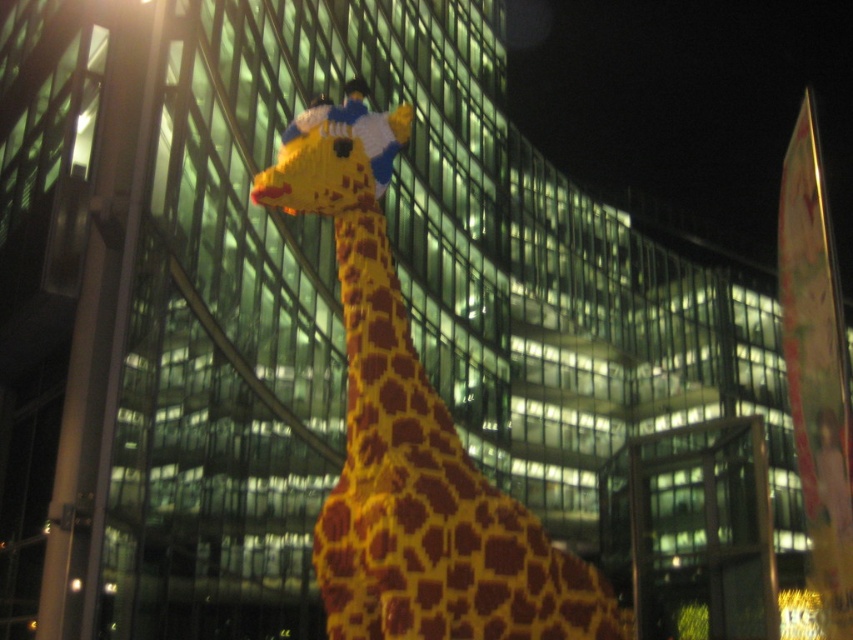
Does point (608, 592) lie behind point (99, 401)?

No, (608, 592) is in front of (99, 401).

Which is in front, point (395, 444) or point (105, 227)?

Point (395, 444)

The height and width of the screenshot is (640, 853). In order to click on yellow matte giraffe at center in this screenshot , I will do `click(410, 436)`.